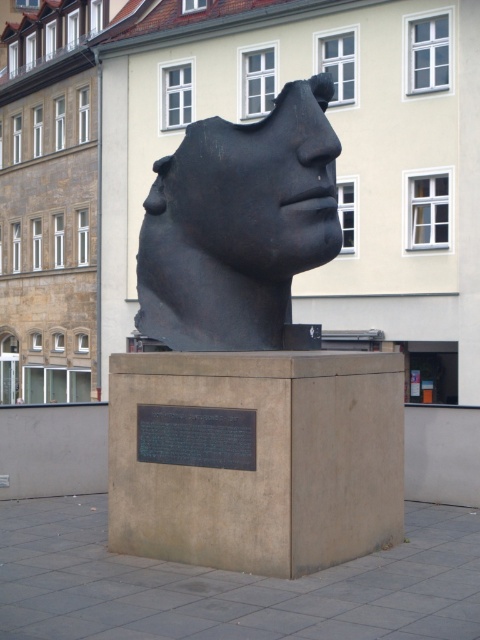
Between black matte head at center and black matte sculpture at center, which one is positioned lower?

black matte head at center

Is black matte head at center shorter than black matte sculpture at center?

No.

Describe the element at coordinates (250, 364) in the screenshot. I see `black matte head at center` at that location.

This screenshot has width=480, height=640. What are the coordinates of `black matte head at center` in the screenshot? It's located at (250, 364).